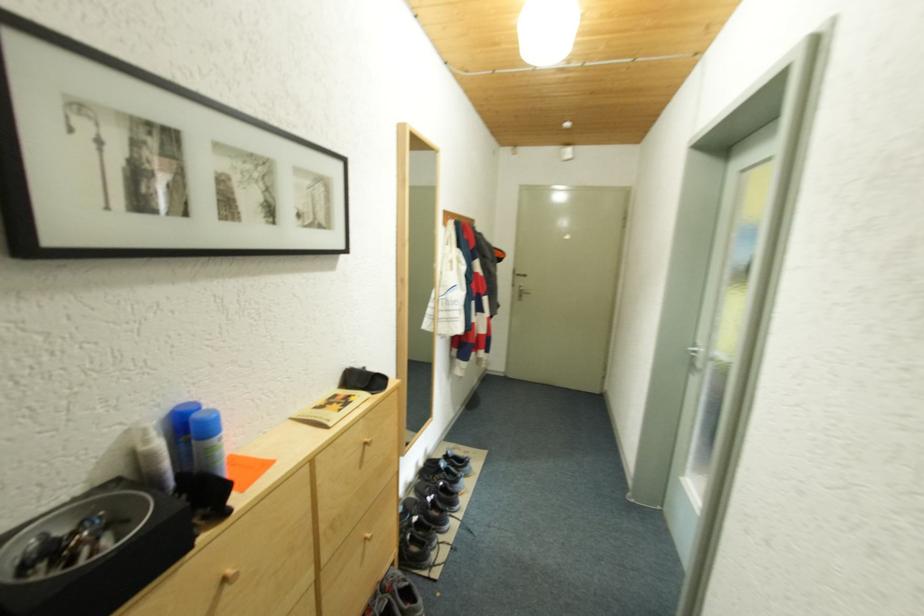
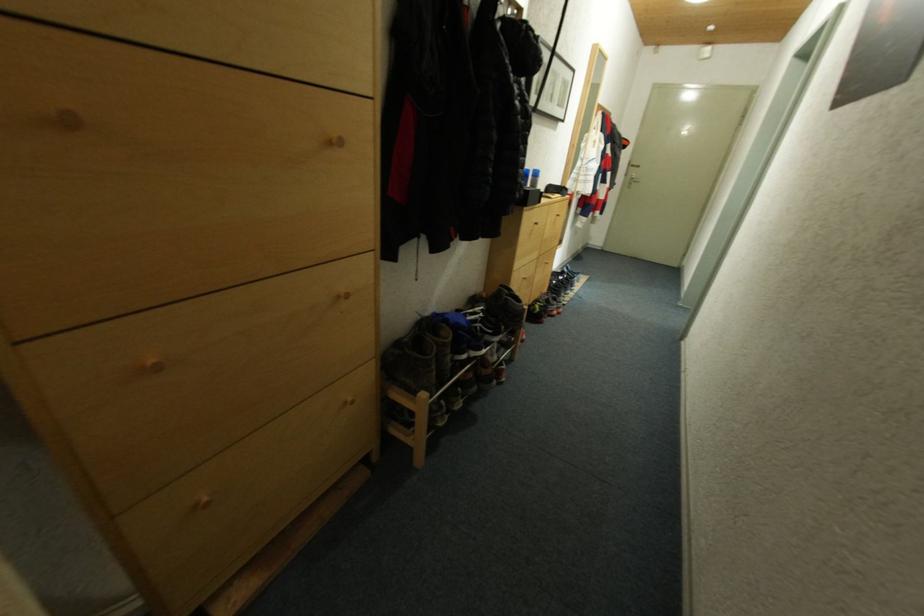
Question: Which direction would the cameraman need to move to produce the second image? Reply with the corresponding letter.

Choices:
 (A) Left
 (B) Right
 (C) Forward
 (D) Backward

Answer: (D)